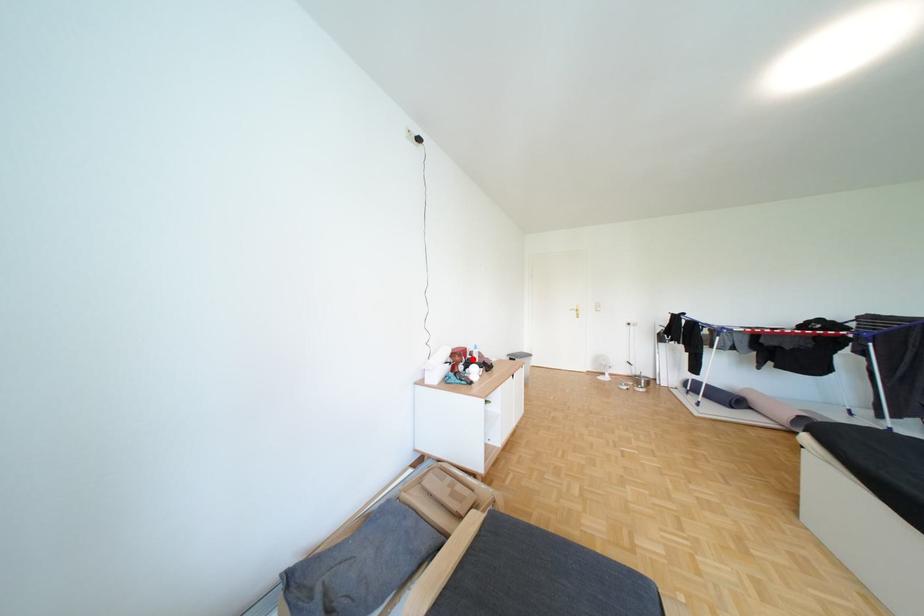
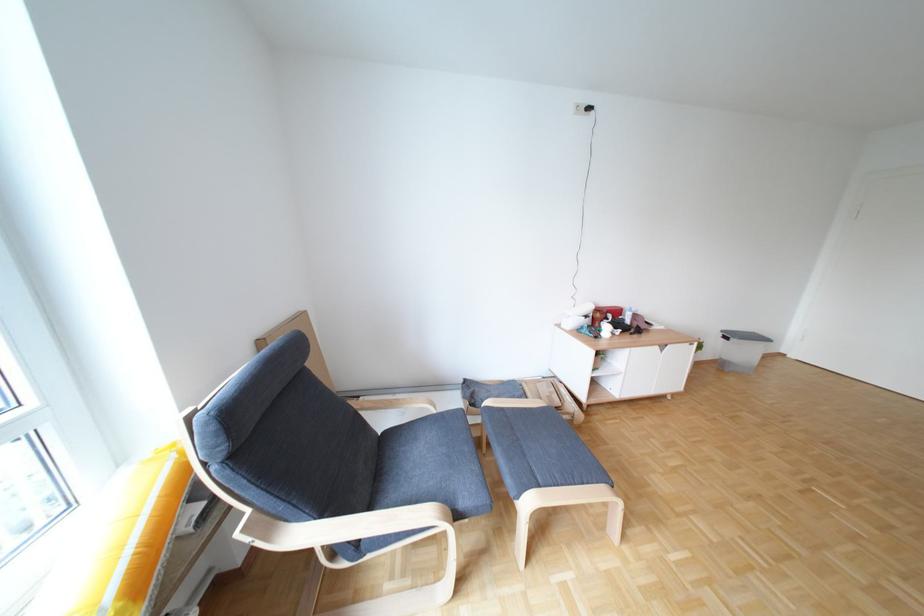
Locate, in the second image, the point that corresponds to the highlighted location in the first image.

(614, 315)